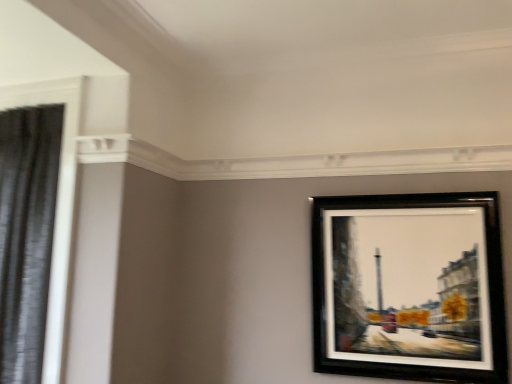
Question: Is black fabric shower curtain at left shorter than black glossy picture frame at upper right?

Choices:
 (A) yes
 (B) no

Answer: (B)

Question: Is black fabric shower curtain at left thinner than black glossy picture frame at upper right?

Choices:
 (A) yes
 (B) no

Answer: (B)

Question: Could you tell me if black fabric shower curtain at left is turned towards black glossy picture frame at upper right?

Choices:
 (A) yes
 (B) no

Answer: (B)

Question: Is black fabric shower curtain at left oriented away from black glossy picture frame at upper right?

Choices:
 (A) no
 (B) yes

Answer: (A)

Question: From the image's perspective, is black fabric shower curtain at left on top of black glossy picture frame at upper right?

Choices:
 (A) no
 (B) yes

Answer: (B)

Question: Can we say black fabric shower curtain at left lies outside black glossy picture frame at upper right?

Choices:
 (A) no
 (B) yes

Answer: (B)

Question: Is the position of black glossy picture frame at upper right more distant than that of black fabric shower curtain at left?

Choices:
 (A) no
 (B) yes

Answer: (B)

Question: Would you say black glossy picture frame at upper right is a long distance from black fabric shower curtain at left?

Choices:
 (A) yes
 (B) no

Answer: (A)

Question: Does black glossy picture frame at upper right have a greater width compared to black fabric shower curtain at left?

Choices:
 (A) no
 (B) yes

Answer: (A)

Question: Is black fabric shower curtain at left located within black glossy picture frame at upper right?

Choices:
 (A) yes
 (B) no

Answer: (B)

Question: From a real-world perspective, does black glossy picture frame at upper right stand above black fabric shower curtain at left?

Choices:
 (A) yes
 (B) no

Answer: (B)

Question: Considering the relative sizes of black glossy picture frame at upper right and black fabric shower curtain at left in the image provided, is black glossy picture frame at upper right smaller than black fabric shower curtain at left?

Choices:
 (A) no
 (B) yes

Answer: (B)

Question: Is black glossy picture frame at upper right inside the boundaries of black fabric shower curtain at left, or outside?

Choices:
 (A) inside
 (B) outside

Answer: (B)